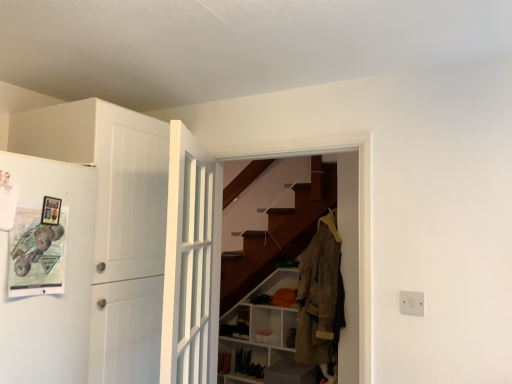
The height and width of the screenshot is (384, 512). What do you see at coordinates (191, 262) in the screenshot?
I see `white glossy door at center, marked as the 1th door in a right-to-left arrangement` at bounding box center [191, 262].

This screenshot has width=512, height=384. I want to click on white glossy door at center, the 2th door from the left, so click(x=191, y=262).

The height and width of the screenshot is (384, 512). Identify the location of white matte cabinet at lower center. (258, 330).

The image size is (512, 384). What are the coordinates of `white plastic switch at lower right` in the screenshot? It's located at pyautogui.click(x=412, y=303).

Can you tell me how much white matte cabinet at lower center and white glossy door at center, the 2th door from the left, differ in facing direction?

114 degrees separate the facing orientations of white matte cabinet at lower center and white glossy door at center, the 2th door from the left.

In the scene shown: Is white matte cabinet at lower center facing towards white glossy door at center, the 2th door from the left?

Yes, white matte cabinet at lower center is oriented towards white glossy door at center, the 2th door from the left.

Which of these two, white matte cabinet at lower center or white glossy door at center, marked as the 1th door in a right-to-left arrangement, stands taller?

white matte cabinet at lower center.

From the image's perspective, is white matte cabinet at lower center located above or below white glossy door at center, marked as the 1th door in a right-to-left arrangement?

white matte cabinet at lower center is below white glossy door at center, marked as the 1th door in a right-to-left arrangement.

From the image's perspective, is white plastic switch at lower right under white glossy door at center, the 2th door from the left?

Yes.

Is the surface of white plastic switch at lower right in direct contact with white glossy door at center, marked as the 1th door in a right-to-left arrangement?

No, white plastic switch at lower right is not with white glossy door at center, marked as the 1th door in a right-to-left arrangement.

From a real-world perspective, is white plastic switch at lower right located higher than white glossy door at center, the 2th door from the left?

Incorrect, from a real-world perspective, white plastic switch at lower right is lower than white glossy door at center, the 2th door from the left.

From a real-world perspective, is tan suede jacket at center above or below white plastic switch at lower right?

tan suede jacket at center is below white plastic switch at lower right.

Considering the positions of objects tan suede jacket at center and white plastic switch at lower right in the image provided, who is more to the right, tan suede jacket at center or white plastic switch at lower right?

From the viewer's perspective, white plastic switch at lower right appears more on the right side.

Is tan suede jacket at center looking in the opposite direction of white plastic switch at lower right?

No, tan suede jacket at center is not facing away from white plastic switch at lower right.

Is tan suede jacket at center located outside white plastic switch at lower right?

tan suede jacket at center is positioned outside white plastic switch at lower right.

Would you say white matte door at left, marked as the second door in a right-to-left arrangement, is to the left or to the right of white matte cabinet at lower center in the picture?

Clearly, white matte door at left, marked as the second door in a right-to-left arrangement, is on the left of white matte cabinet at lower center in the image.

Considering the points (40, 118) and (288, 324), which point is in front, point (40, 118) or point (288, 324)?

Positioned in front is point (40, 118).

Based on the photo, from a real-world perspective, relative to white matte cabinet at lower center, is white matte door at left, which is counted as the 1th door, starting from the left, vertically above or below?

From a real-world perspective, white matte door at left, which is counted as the 1th door, starting from the left, is physically above white matte cabinet at lower center.

Is white matte cabinet at lower center aimed at white plastic switch at lower right?

No, white matte cabinet at lower center is not oriented towards white plastic switch at lower right.

From the picture: In the image, is white matte cabinet at lower center positioned in front of or behind white plastic switch at lower right?

Clearly, white matte cabinet at lower center is behind white plastic switch at lower right.

From the image's perspective, relative to white plastic switch at lower right, is white matte cabinet at lower center above or below?

Clearly, from the image's perspective, white matte cabinet at lower center is below white plastic switch at lower right.

Is white matte cabinet at lower center touching white plastic switch at lower right?

No.

Is white plastic switch at lower right inside or outside of tan suede jacket at center?

white plastic switch at lower right is not enclosed by tan suede jacket at center.

Does white plastic switch at lower right touch tan suede jacket at center?

No, white plastic switch at lower right is not with tan suede jacket at center.

Considering the relative sizes of white plastic switch at lower right and tan suede jacket at center in the image provided, is white plastic switch at lower right taller than tan suede jacket at center?

No.

Considering the sizes of objects white plastic switch at lower right and tan suede jacket at center in the image provided, who is bigger, white plastic switch at lower right or tan suede jacket at center?

tan suede jacket at center is bigger.

Does white matte door at left, which is counted as the 1th door, starting from the left, turn towards tan suede jacket at center?

No, white matte door at left, which is counted as the 1th door, starting from the left, is not facing towards tan suede jacket at center.

From the picture: From a real-world perspective, which object stands above the other?

white matte door at left, marked as the second door in a right-to-left arrangement.

Consider the image. From the image's perspective, is white matte door at left, marked as the second door in a right-to-left arrangement, on tan suede jacket at center?

Indeed, from the image's perspective, white matte door at left, marked as the second door in a right-to-left arrangement, is shown above tan suede jacket at center.

Can you confirm if white matte door at left, which is counted as the 1th door, starting from the left, is thinner than tan suede jacket at center?

No.

The image size is (512, 384). I want to click on the 1st door directly above the white matte cabinet at lower center (from a real-world perspective), so click(191, 262).

What are the coordinates of `door that is the 1st one when counting leftward from the white plastic switch at lower right` in the screenshot? It's located at (191, 262).

Looking at the image, which one is located closer to white glossy door at center, the 2th door from the left, white plastic switch at lower right or tan suede jacket at center?

white plastic switch at lower right lies closer to white glossy door at center, the 2th door from the left, than the other object.

From the image, which object appears to be nearer to tan suede jacket at center, white glossy door at center, marked as the 1th door in a right-to-left arrangement, or white matte cabinet at lower center?

white matte cabinet at lower center lies closer to tan suede jacket at center than the other object.

From the image, which object appears to be farther from tan suede jacket at center, white matte cabinet at lower center or white matte door at left, which is counted as the 1th door, starting from the left?

white matte door at left, which is counted as the 1th door, starting from the left, is further to tan suede jacket at center.

Considering their positions, is white matte door at left, marked as the second door in a right-to-left arrangement, positioned closer to white plastic switch at lower right than white matte cabinet at lower center?

white matte door at left, marked as the second door in a right-to-left arrangement, is closer to white plastic switch at lower right.

When comparing their distances from white matte cabinet at lower center, does white plastic switch at lower right or tan suede jacket at center seem further?

white plastic switch at lower right is further to white matte cabinet at lower center.

Looking at the image, which one is located closer to white matte door at left, marked as the second door in a right-to-left arrangement, white matte cabinet at lower center or white glossy door at center, the 2th door from the left?

white glossy door at center, the 2th door from the left, is positioned closer to the anchor white matte door at left, marked as the second door in a right-to-left arrangement.

Looking at the image, which one is located closer to white plastic switch at lower right, white glossy door at center, marked as the 1th door in a right-to-left arrangement, or tan suede jacket at center?

white glossy door at center, marked as the 1th door in a right-to-left arrangement.

Based on their spatial positions, is tan suede jacket at center or white matte door at left, which is counted as the 1th door, starting from the left, further from white glossy door at center, marked as the 1th door in a right-to-left arrangement?

tan suede jacket at center.

This screenshot has width=512, height=384. Find the location of `door positioned between white glossy door at center, the 2th door from the left, and tan suede jacket at center from near to far`. door positioned between white glossy door at center, the 2th door from the left, and tan suede jacket at center from near to far is located at coordinates click(123, 231).

This screenshot has height=384, width=512. Identify the location of door located between white matte door at left, which is counted as the 1th door, starting from the left, and white plastic switch at lower right in the left-right direction. (191, 262).

Where is `electric outlet located between white glossy door at center, the 2th door from the left, and tan suede jacket at center in the depth direction`? electric outlet located between white glossy door at center, the 2th door from the left, and tan suede jacket at center in the depth direction is located at coordinates 412,303.

Find the location of a particular element. clothing between white matte door at left, marked as the second door in a right-to-left arrangement, and white plastic switch at lower right from left to right is located at coordinates (320, 296).